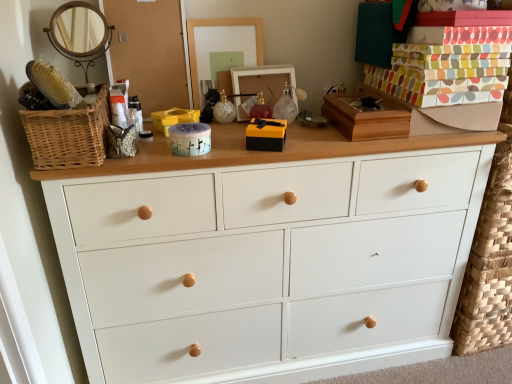
Locate an element on the screen. This screenshot has width=512, height=384. free space in front of translucent plastic tube at center is located at coordinates (141, 160).